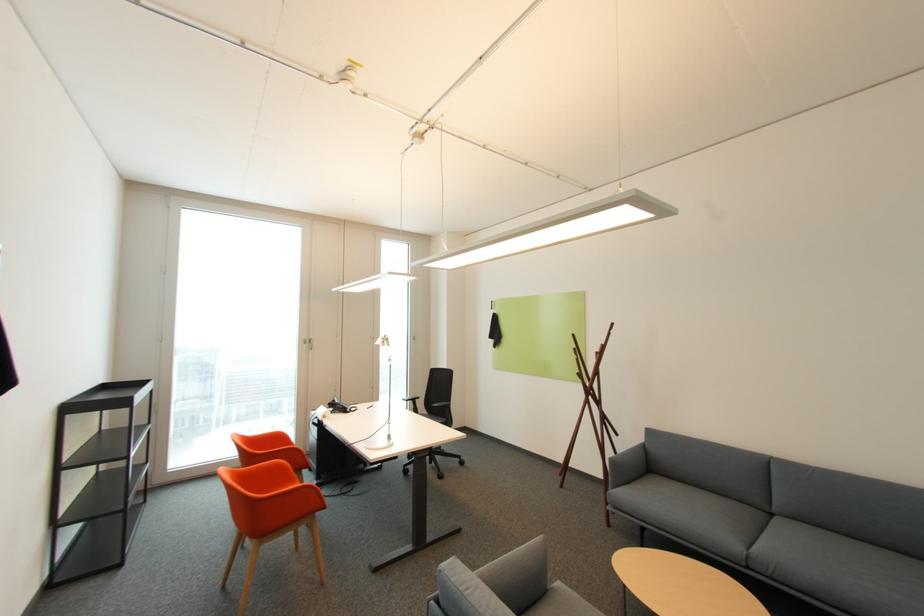
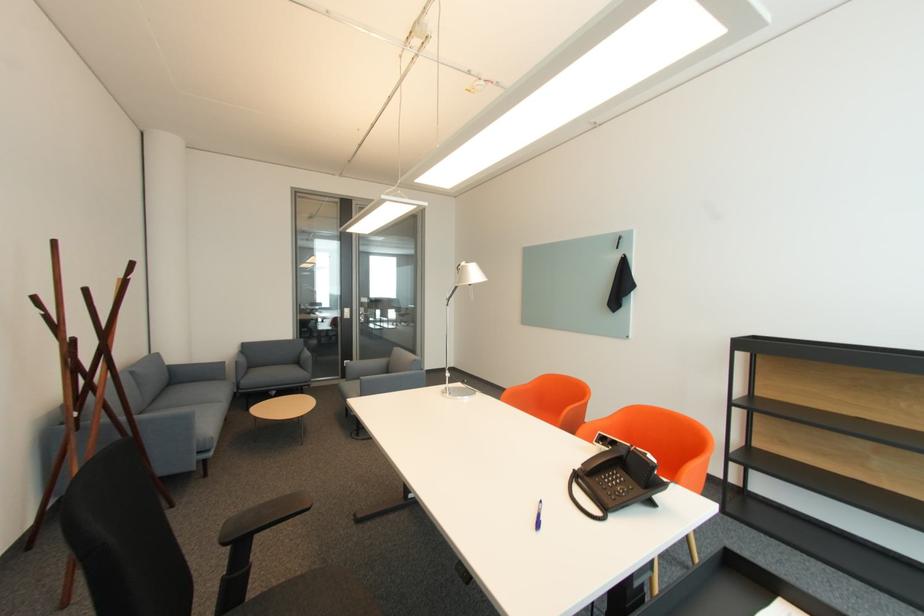
Locate, in the second image, the point that corresponds to (x=781, y=515) in the first image.

(151, 411)